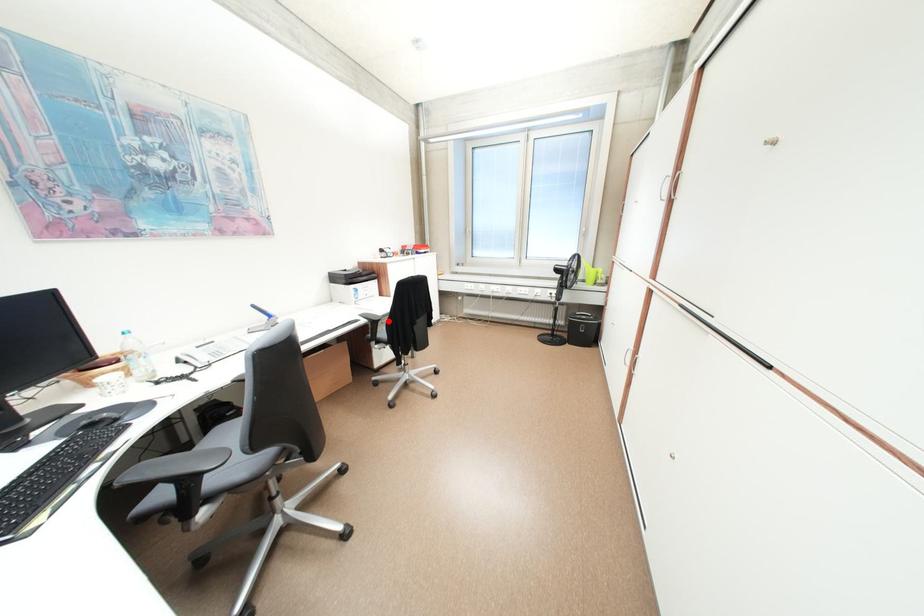
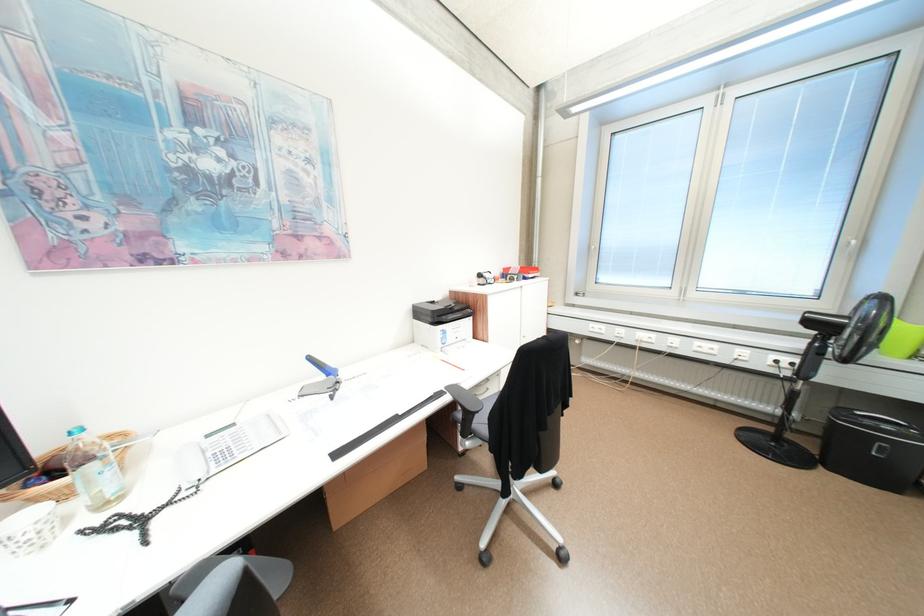
Question: I am providing you with two images of the same scene from different viewpoints. In image1, a red point is highlighted. Considering the same 3D point in image2, which of the following is correct?

Choices:
 (A) It is closer
 (B) It is farther

Answer: (A)